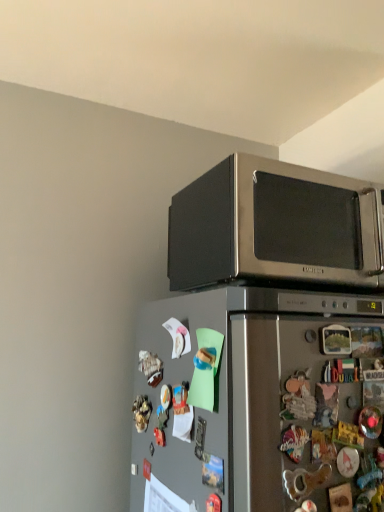
Question: Is point (327, 224) positioned closer to the camera than point (231, 289)?

Choices:
 (A) closer
 (B) farther

Answer: (B)

Question: From the image's perspective, is stainless steel microwave at upper right above or below satin silver refrigerator at lower left?

Choices:
 (A) above
 (B) below

Answer: (A)

Question: Considering the relative positions of stainless steel microwave at upper right and satin silver refrigerator at lower left in the image provided, is stainless steel microwave at upper right to the left or to the right of satin silver refrigerator at lower left?

Choices:
 (A) left
 (B) right

Answer: (B)

Question: In terms of height, does satin silver refrigerator at lower left look taller or shorter compared to stainless steel microwave at upper right?

Choices:
 (A) short
 (B) tall

Answer: (B)

Question: In the image, is satin silver refrigerator at lower left on the left side or the right side of stainless steel microwave at upper right?

Choices:
 (A) left
 (B) right

Answer: (A)

Question: Which is correct: satin silver refrigerator at lower left is inside stainless steel microwave at upper right, or outside of it?

Choices:
 (A) outside
 (B) inside

Answer: (A)

Question: From a real-world perspective, relative to stainless steel microwave at upper right, is satin silver refrigerator at lower left vertically above or below?

Choices:
 (A) below
 (B) above

Answer: (A)